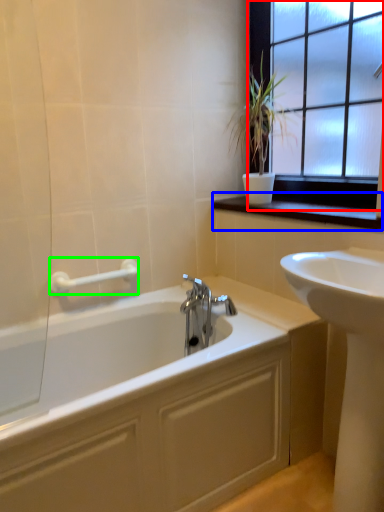
Question: Considering the real-world distances, which object is closest to window (highlighted by a red box)? window sill (highlighted by a blue box) or towel bar (highlighted by a green box).

Choices:
 (A) window sill
 (B) towel bar

Answer: (A)